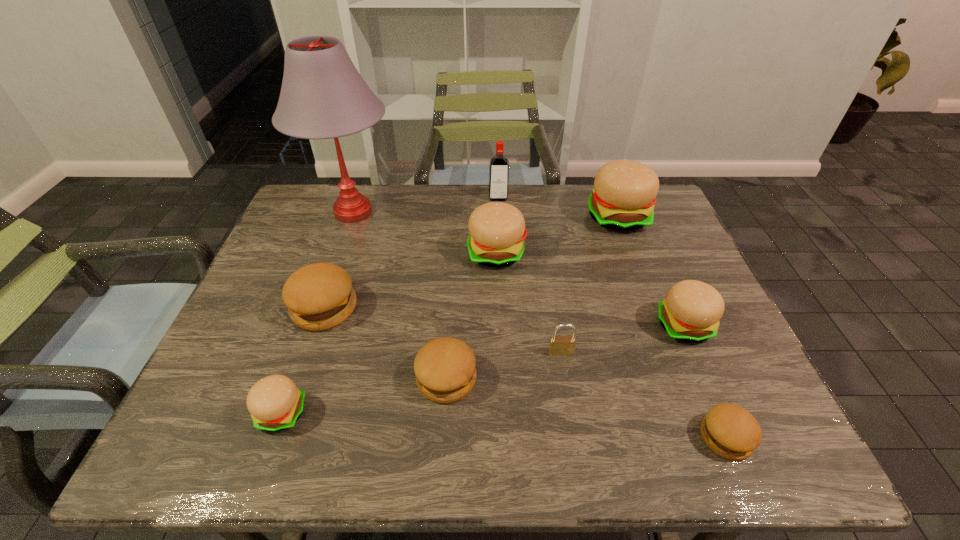
The image size is (960, 540). In order to click on hamburger located at the far edge in this screenshot , I will do `click(624, 194)`.

I want to click on table lamp positioned at the left edge, so click(323, 96).

Find the location of a particular element. Image resolution: width=960 pixels, height=540 pixels. object at the far left corner is located at coordinates (323, 96).

What are the coordinates of `object positioned at the near left corner` in the screenshot? It's located at (275, 403).

Locate an element on the screen. The height and width of the screenshot is (540, 960). object that is at the far right corner is located at coordinates (624, 194).

Locate an element on the screen. object that is at the near right corner is located at coordinates (730, 431).

You are a GUI agent. You are given a task and a screenshot of the screen. Output one action in this format:
    pyautogui.click(x=<x>, y=<y>)
    Task: Click on the free point at the far edge
    
    Given the screenshot: What is the action you would take?
    pyautogui.click(x=557, y=220)

Where is `free location at the left edge of the desktop`? free location at the left edge of the desktop is located at coordinates (240, 332).

The height and width of the screenshot is (540, 960). Identify the location of vacant area at the right edge of the desktop. 643,247.

Where is `free space at the far left corner of the desktop`? free space at the far left corner of the desktop is located at coordinates (315, 193).